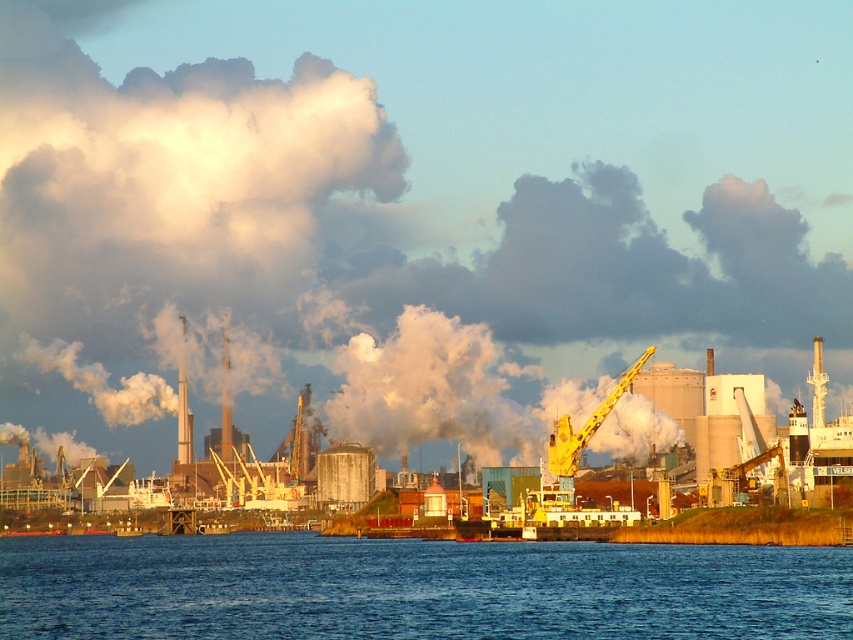
Question: Which object is farther from the camera taking this photo?

Choices:
 (A) white smoke at upper center
 (B) blue liquid water at lower center
 (C) yellow metallic crane at center

Answer: (B)

Question: Is blue liquid water at lower center thinner than yellow metallic crane at center?

Choices:
 (A) no
 (B) yes

Answer: (A)

Question: Which object is the farthest from the blue liquid water at lower center?

Choices:
 (A) white smoke at upper center
 (B) yellow metallic crane at center

Answer: (A)

Question: Estimate the real-world distances between objects in this image. Which object is closer to the white smoke at upper center?

Choices:
 (A) yellow metallic crane at center
 (B) blue liquid water at lower center

Answer: (A)

Question: Does white smoke at upper center appear over yellow metallic crane at center?

Choices:
 (A) yes
 (B) no

Answer: (A)

Question: Is blue liquid water at lower center to the right of yellow metallic crane at center from the viewer's perspective?

Choices:
 (A) no
 (B) yes

Answer: (A)